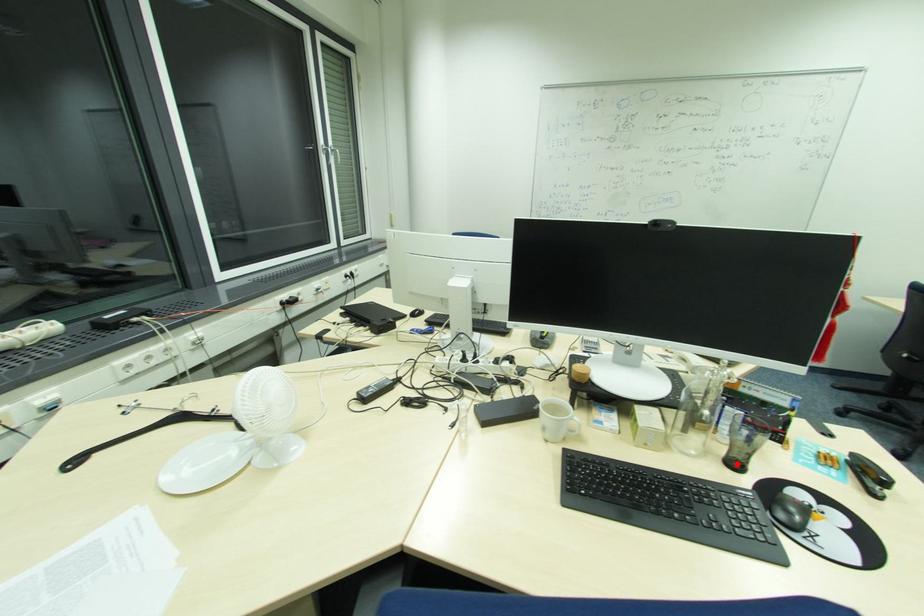
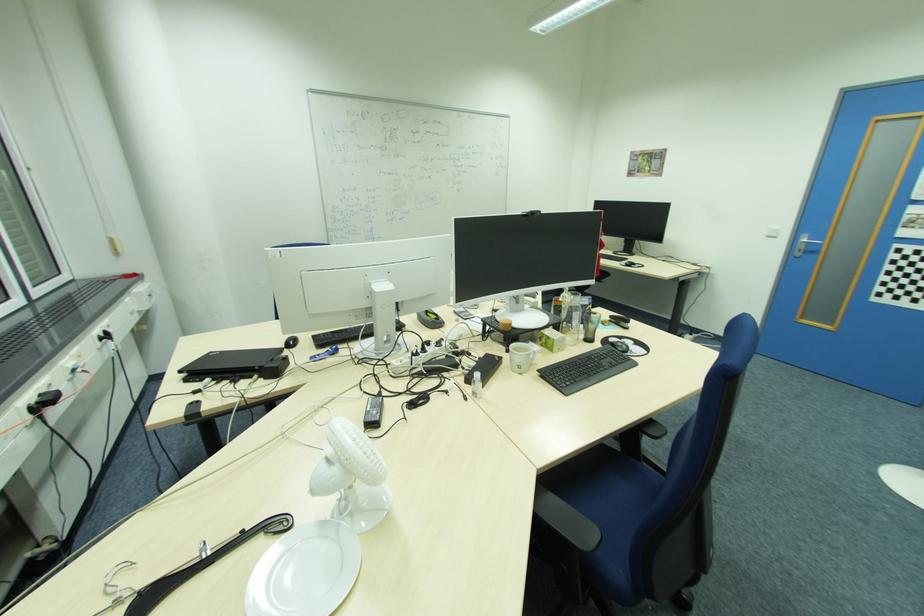
Find the pixel in the second image that matches the highlighted location in the first image.

(591, 339)